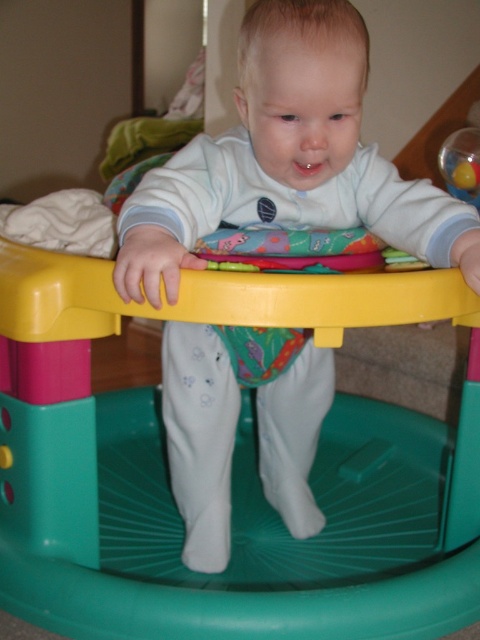
In the scene shown: Does plastic walker at center have a smaller size compared to white matte baby walker at center?

No, plastic walker at center is not smaller than white matte baby walker at center.

Who is shorter, plastic walker at center or white matte baby walker at center?

plastic walker at center is shorter.

The height and width of the screenshot is (640, 480). I want to click on plastic walker at center, so click(x=232, y=497).